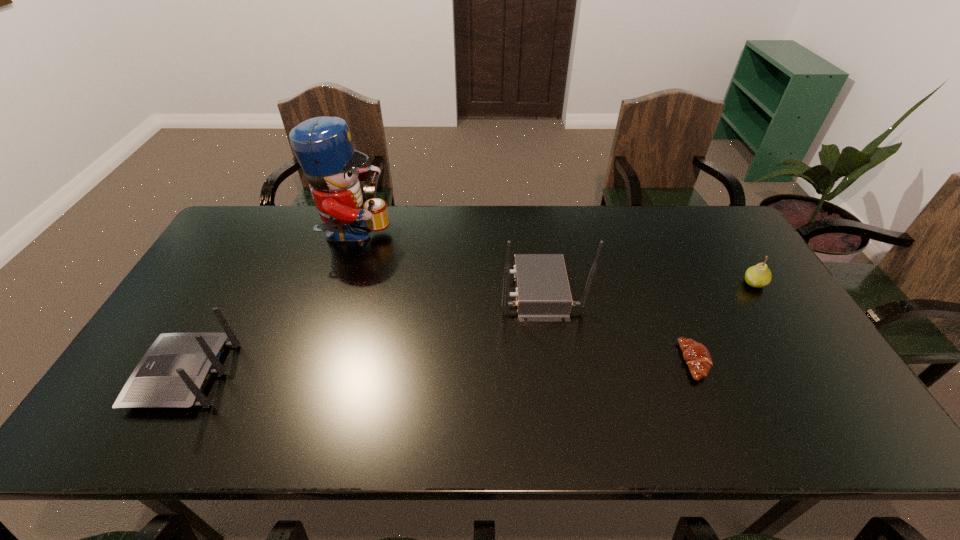
Locate an element on the screen. This screenshot has width=960, height=540. free space located 0.250m on the front-facing side of the second object from left to right is located at coordinates (465, 237).

You are a GUI agent. You are given a task and a screenshot of the screen. Output one action in this format:
    pyautogui.click(x=<x>, y=<y>)
    Task: Click on the free space located on the back of the farther router to connect cables
    The width and height of the screenshot is (960, 540).
    Given the screenshot: What is the action you would take?
    pyautogui.click(x=429, y=291)

Where is `vacant region located 0.200m on the back of the farther router to connect cables`? vacant region located 0.200m on the back of the farther router to connect cables is located at coordinates (433, 291).

Identify the location of free space located on the back of the farther router to connect cables. Image resolution: width=960 pixels, height=540 pixels. (443, 291).

Where is `blank space located 0.320m on the front of the fourth tallest object`? This screenshot has width=960, height=540. blank space located 0.320m on the front of the fourth tallest object is located at coordinates (819, 386).

Locate an element on the screen. Image resolution: width=960 pixels, height=540 pixels. vacant space located 0.310m on the left of the shortest object is located at coordinates (560, 361).

You are a GUI agent. You are given a task and a screenshot of the screen. Output one action in this format:
    pyautogui.click(x=<x>, y=<y>)
    Task: Click on the object situated at the far edge
    This screenshot has height=540, width=960.
    Given the screenshot: What is the action you would take?
    pyautogui.click(x=323, y=146)

Identify the location of object at the near edge. Image resolution: width=960 pixels, height=540 pixels. (173, 373).

Locate an element on the screen. object that is at the left edge is located at coordinates (173, 373).

Identify the location of object located at the right edge. (758, 276).